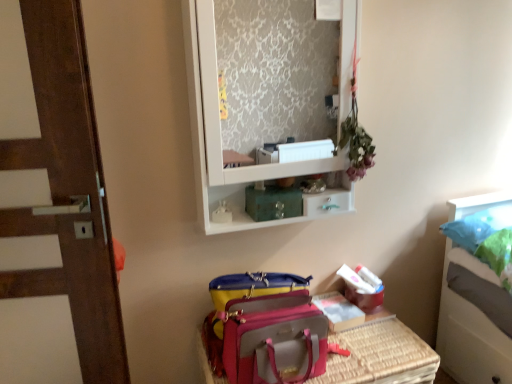
Question: Is metallic teal drawer at upper center at the left side of white glossy medicine cabinet at upper center?

Choices:
 (A) yes
 (B) no

Answer: (B)

Question: From a real-world perspective, is metallic teal drawer at upper center positioned under white glossy medicine cabinet at upper center based on gravity?

Choices:
 (A) no
 (B) yes

Answer: (B)

Question: Considering the relative sizes of metallic teal drawer at upper center and white glossy medicine cabinet at upper center in the image provided, is metallic teal drawer at upper center taller than white glossy medicine cabinet at upper center?

Choices:
 (A) no
 (B) yes

Answer: (A)

Question: Is white glossy medicine cabinet at upper center completely or partially inside metallic teal drawer at upper center?

Choices:
 (A) yes
 (B) no

Answer: (B)

Question: From a real-world perspective, is metallic teal drawer at upper center physically above white glossy medicine cabinet at upper center?

Choices:
 (A) yes
 (B) no

Answer: (B)

Question: Looking at the image, does metallic teal drawer at upper center seem bigger or smaller compared to pink fabric suitcase at lower center?

Choices:
 (A) small
 (B) big

Answer: (A)

Question: From the image's perspective, relative to pink fabric suitcase at lower center, is metallic teal drawer at upper center above or below?

Choices:
 (A) below
 (B) above

Answer: (B)

Question: Is metallic teal drawer at upper center situated inside pink fabric suitcase at lower center or outside?

Choices:
 (A) outside
 (B) inside

Answer: (A)

Question: Considering their positions, is metallic teal drawer at upper center located in front of or behind pink fabric suitcase at lower center?

Choices:
 (A) front
 (B) behind

Answer: (B)

Question: From the image's perspective, is pink fabric suitcase at lower center above or below metallic teal drawer at upper center?

Choices:
 (A) below
 (B) above

Answer: (A)

Question: Is pink fabric suitcase at lower center taller or shorter than metallic teal drawer at upper center?

Choices:
 (A) short
 (B) tall

Answer: (B)

Question: Is point (364, 367) positioned closer to the camera than point (343, 190)?

Choices:
 (A) farther
 (B) closer

Answer: (B)

Question: In terms of size, does pink fabric suitcase at lower center appear bigger or smaller than metallic teal drawer at upper center?

Choices:
 (A) small
 (B) big

Answer: (B)

Question: Is point (304, 208) positioned closer to the camera than point (311, 114)?

Choices:
 (A) farther
 (B) closer

Answer: (B)

Question: In terms of size, does metallic teal drawer at upper center appear bigger or smaller than white glossy medicine cabinet at upper center?

Choices:
 (A) small
 (B) big

Answer: (A)